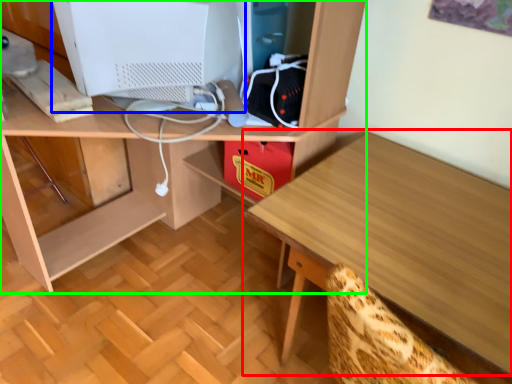
Question: Which object is positioned farthest from table (highlighted by a red box)? Select from computer monitor (highlighted by a blue box) and desk (highlighted by a green box).

Choices:
 (A) computer monitor
 (B) desk

Answer: (A)